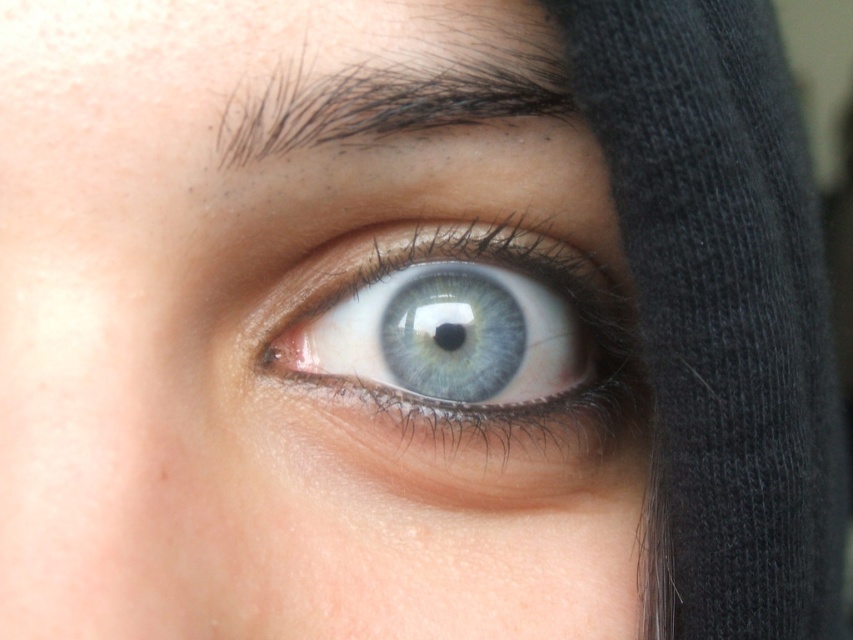
Question: Which of the following is the farthest from the observer?

Choices:
 (A) (337, 74)
 (B) (613, 308)

Answer: (B)

Question: Which point appears farthest from the camera in this image?

Choices:
 (A) (552, 112)
 (B) (619, 408)

Answer: (B)

Question: Which point is closer to the camera?

Choices:
 (A) (532, 403)
 (B) (320, 72)

Answer: (B)

Question: Can you confirm if blue glassy eye at center is bigger than dark brown hair at upper center?

Choices:
 (A) yes
 (B) no

Answer: (A)

Question: Where is blue glassy eye at center located in relation to dark brown hair at upper center in the image?

Choices:
 (A) right
 (B) left

Answer: (A)

Question: Does blue glassy eye at center have a smaller size compared to dark brown hair at upper center?

Choices:
 (A) yes
 (B) no

Answer: (B)